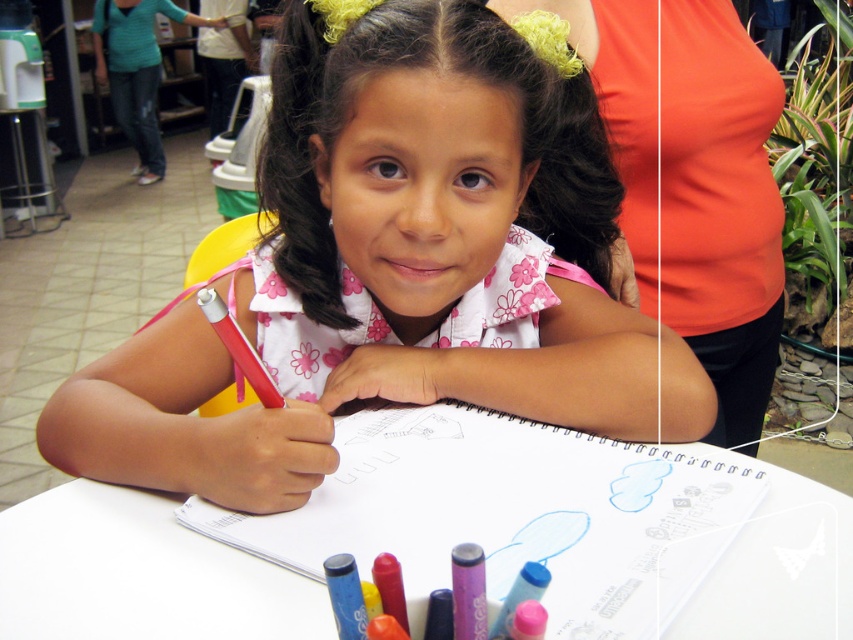
Measure the distance between white paper at center and camera.

The distance of white paper at center from camera is 16.37 inches.

Does white paper at center appear on the left side of matte red pencil at center?

In fact, white paper at center is to the right of matte red pencil at center.

Is point (366, 506) closer to camera compared to point (247, 369)?

That is False.

This screenshot has width=853, height=640. I want to click on white paper at center, so click(x=444, y=540).

Who is taller, pink floral blouse at center or matte pink crayon at center?

Standing taller between the two is pink floral blouse at center.

Which is more to the right, pink floral blouse at center or matte pink crayon at center?

matte pink crayon at center

Is point (514, 333) more distant than point (383, 596)?

Yes, point (514, 333) is behind point (383, 596).

Locate an element on the screen. pink floral blouse at center is located at coordinates [397, 264].

Does pink floral blouse at center have a larger size compared to white paper at center?

Indeed, pink floral blouse at center has a larger size compared to white paper at center.

At what (x,y) coordinates should I click in order to perform the action: click on pink floral blouse at center. Please return your answer as a coordinate pair (x, y). This screenshot has height=640, width=853. Looking at the image, I should click on (397, 264).

You are a GUI agent. You are given a task and a screenshot of the screen. Output one action in this format:
    pyautogui.click(x=<x>, y=<y>)
    Task: Click on the pink floral blouse at center
    This screenshot has width=853, height=640.
    Given the screenshot: What is the action you would take?
    pyautogui.click(x=397, y=264)